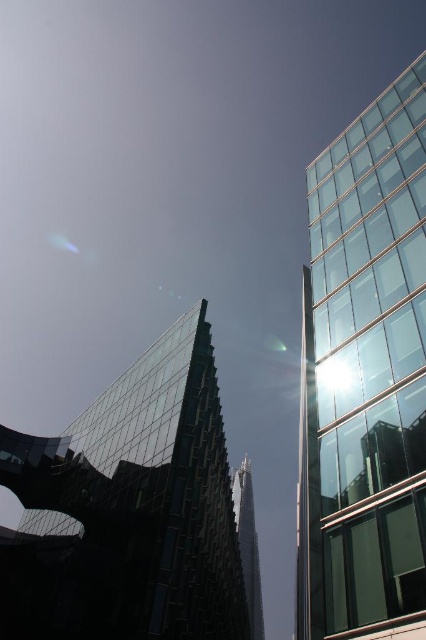
Question: Which object is positioned closest to the transparent glass tower at center?

Choices:
 (A) glassy steel tower at center
 (B) transparent glass tower at right

Answer: (B)

Question: Which of the following is the farthest from the observer?

Choices:
 (A) glassy steel tower at center
 (B) transparent glass tower at right
 (C) transparent glass tower at center

Answer: (A)

Question: Observing the image, what is the correct spatial positioning of transparent glass tower at center in reference to glassy steel tower at center?

Choices:
 (A) right
 (B) left

Answer: (B)

Question: Which point is farther to the camera?

Choices:
 (A) transparent glass tower at center
 (B) transparent glass tower at right
 (C) glassy steel tower at center

Answer: (C)

Question: Is transparent glass tower at center smaller than glassy steel tower at center?

Choices:
 (A) yes
 (B) no

Answer: (A)

Question: In this image, where is transparent glass tower at center located relative to glassy steel tower at center?

Choices:
 (A) right
 (B) left

Answer: (B)